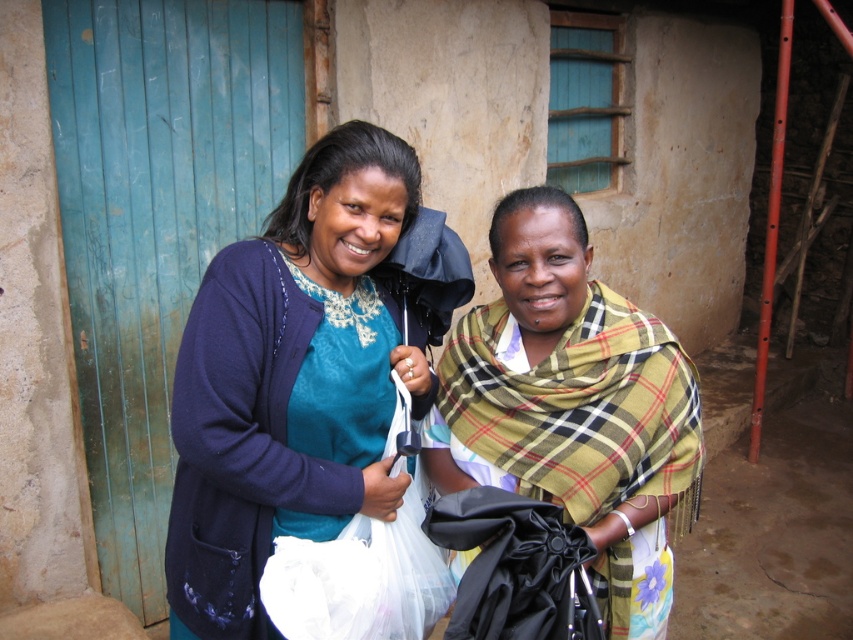
Can you confirm if plaid fabric shawl at center is positioned to the left of white plastic bag at center?

In fact, plaid fabric shawl at center is to the right of white plastic bag at center.

Can you confirm if plaid fabric shawl at center is positioned below white plastic bag at center?

No, plaid fabric shawl at center is not below white plastic bag at center.

Identify the location of plaid fabric shawl at center. (572, 406).

Which is below, matte blue sweater at center or plaid fabric shawl at center?

plaid fabric shawl at center is lower down.

Where is `matte blue sweater at center`? matte blue sweater at center is located at coordinates (289, 381).

Who is positioned more to the right, matte blue sweater at center or white plastic bag at center?

white plastic bag at center

Is matte blue sweater at center smaller than white plastic bag at center?

Actually, matte blue sweater at center might be larger than white plastic bag at center.

Where is `matte blue sweater at center`? matte blue sweater at center is located at coordinates (289, 381).

This screenshot has height=640, width=853. I want to click on matte blue sweater at center, so click(x=289, y=381).